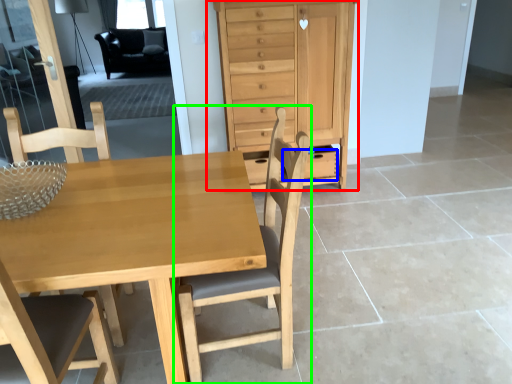
Question: Estimate the real-world distances between objects in this image. Which object is farther from chest of drawers (highlighted by a red box), drawer (highlighted by a blue box) or chair (highlighted by a green box)?

Choices:
 (A) drawer
 (B) chair

Answer: (B)